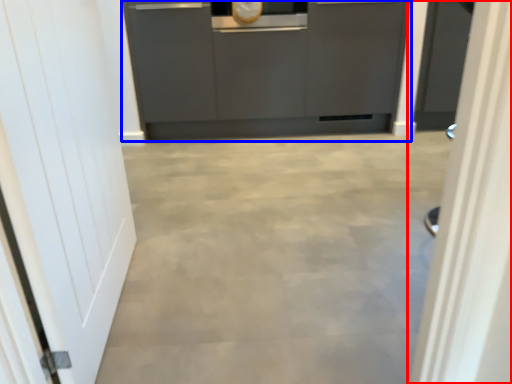
Question: Which object is further to the camera taking this photo, door (highlighted by a red box) or cabinetry (highlighted by a blue box)?

Choices:
 (A) door
 (B) cabinetry

Answer: (B)